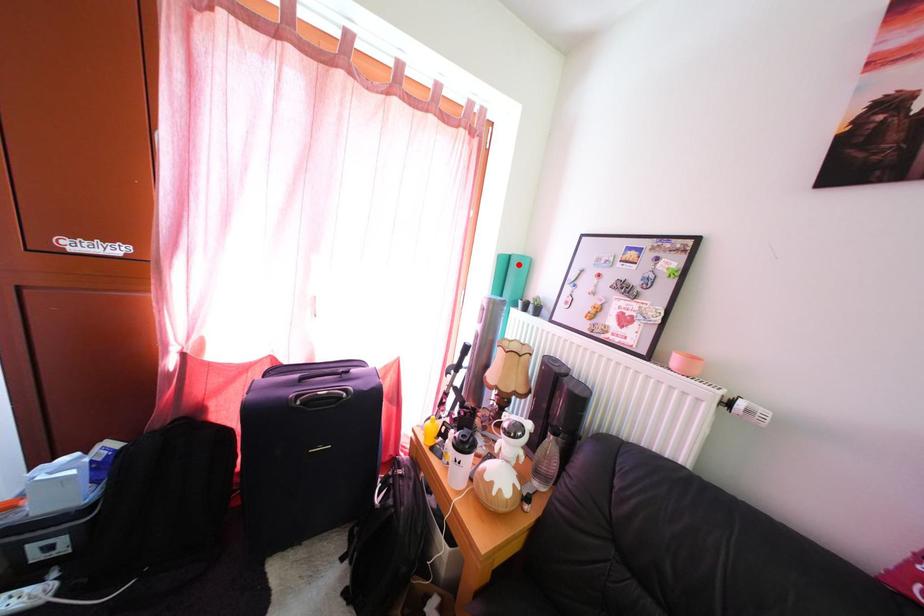
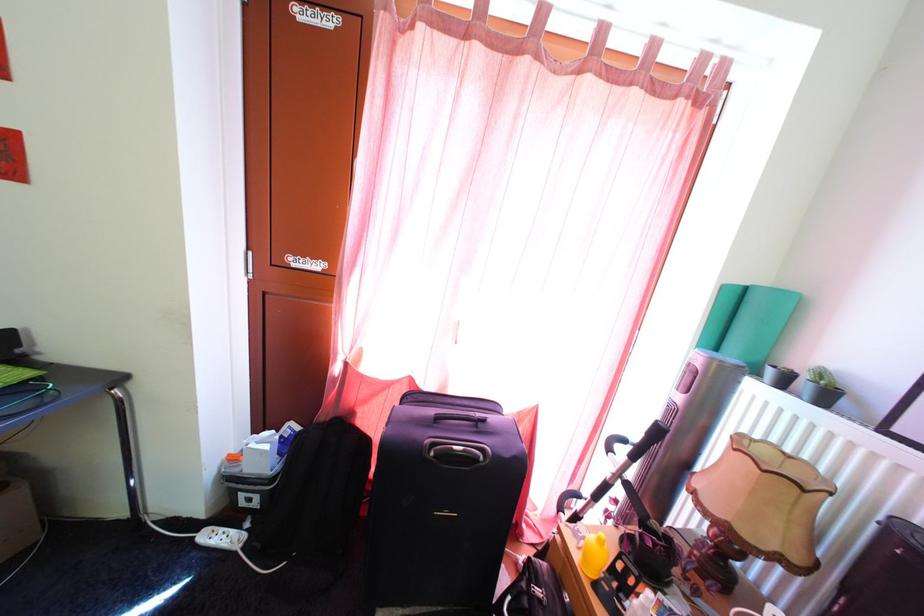
Locate, in the second image, the point that corresponds to the highlighted location in the first image.

(756, 297)